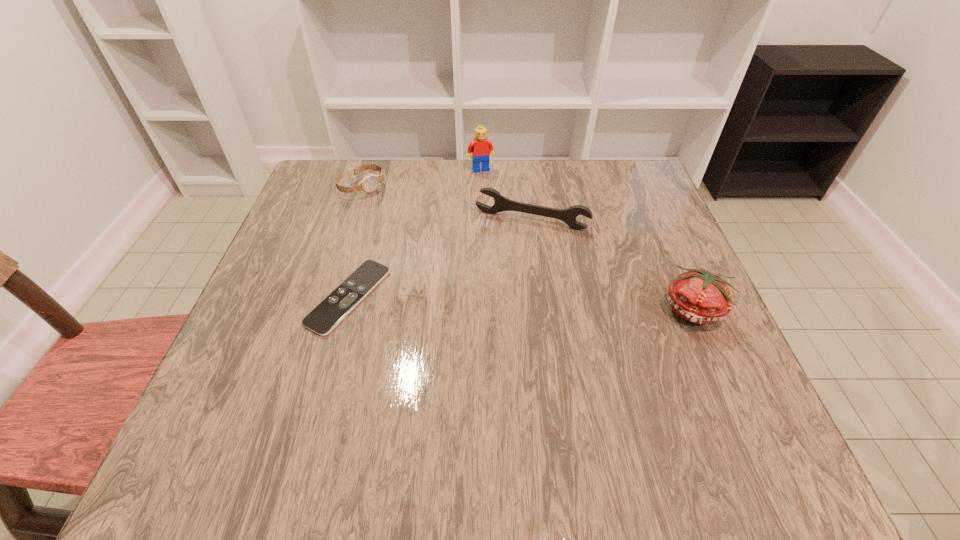
Locate an element on the screen. The width and height of the screenshot is (960, 540). the shortest object is located at coordinates (336, 306).

Where is `the rightmost object`? the rightmost object is located at coordinates (698, 296).

At what (x,y) coordinates should I click in order to perform the action: click on the second tallest object. Please return your answer as a coordinate pair (x, y). The height and width of the screenshot is (540, 960). Looking at the image, I should click on (698, 296).

I want to click on the third nearest object, so click(x=501, y=203).

At what (x,y) coordinates should I click in order to perform the action: click on wrench. Please return your answer as a coordinate pair (x, y). Looking at the image, I should click on (x=501, y=203).

You are a GUI agent. You are given a task and a screenshot of the screen. Output one action in this format:
    pyautogui.click(x=<x>, y=<y>)
    Task: Click on the second shortest object
    
    Given the screenshot: What is the action you would take?
    pyautogui.click(x=370, y=182)

Where is `watch`? watch is located at coordinates (370, 182).

Locate an element on the screen. Image resolution: width=960 pixels, height=540 pixels. Lego is located at coordinates (481, 148).

You are a GUI agent. You are given a task and a screenshot of the screen. Output one action in this format:
    pyautogui.click(x=<x>, y=<y>)
    Task: Click on the tallest object
    The width and height of the screenshot is (960, 540).
    Given the screenshot: What is the action you would take?
    (x=481, y=148)

Identify the location of free space located on the back of the shortest object. (385, 165).